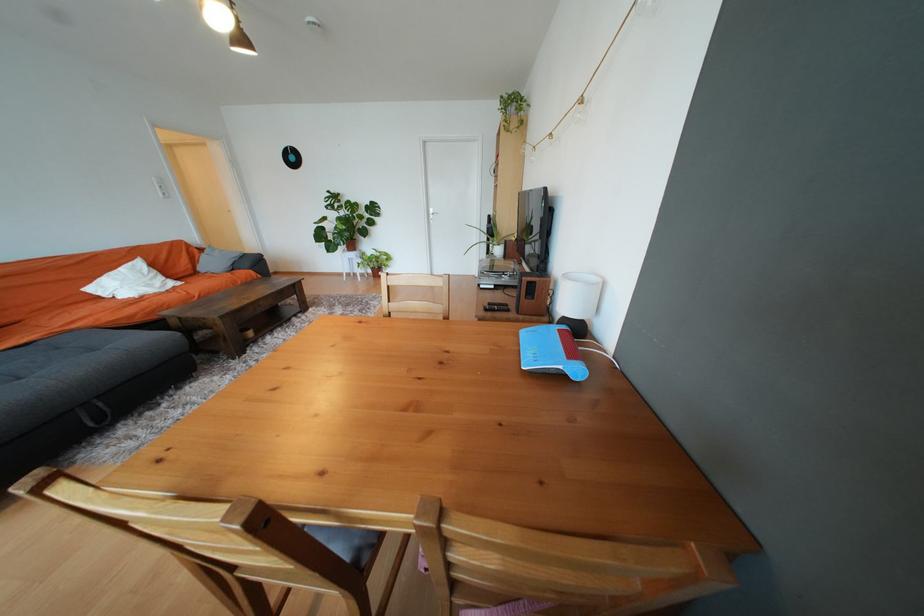
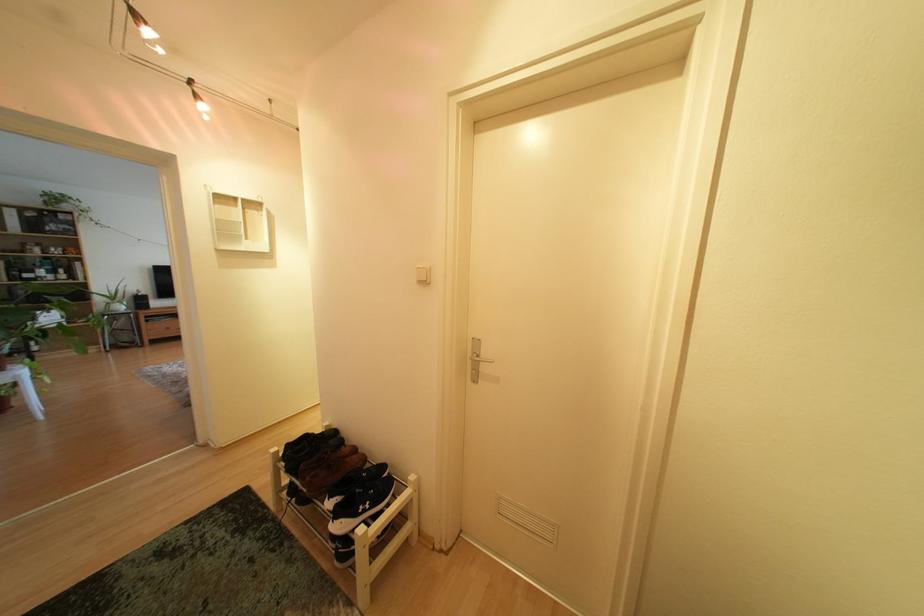
Question: I am providing you with two images of the same scene from different viewpoints. After the viewpoint changes to image2, which objects are now occluded?

Choices:
 (A) cabinet drawer handle
 (B) red spatula handle
 (C) black remote control
 (D) white light switch

Answer: (C)